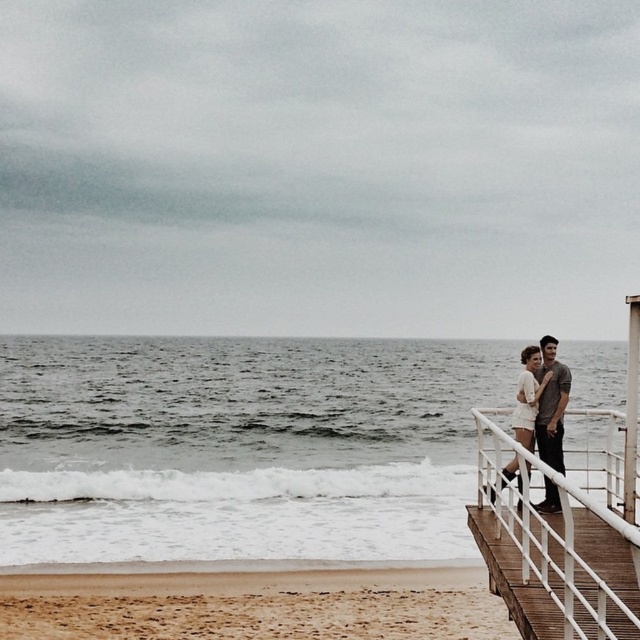
You are a photographer positioned on the wooden pier and want to capture a photo of the two individuals wearing the white cotton dress at right and dark gray jeans at right. Which clothing item will appear larger in the photo due to their positions?

The white cotton dress at right will appear larger in the photo because it is much taller than the dark gray jeans at right.

You are standing on the wooden pier looking towards the ocean. You see the white wooden railing at right and the dark gray jeans at right. Which object is closer to you?

The white wooden railing at right is closer to you because it is in front of the dark gray jeans at right.

You are a photographer standing on the beach and want to frame both the white wooden railing at right and the dark gray jeans at right in your shot. Which object should you position closer to the edge of your camera frame to ensure both fit without cropping?

Since the white wooden railing at right is wider than the dark gray jeans at right, you should position the white wooden railing at right closer to the edge of your camera frame to accommodate its greater width and ensure both fit without cropping.